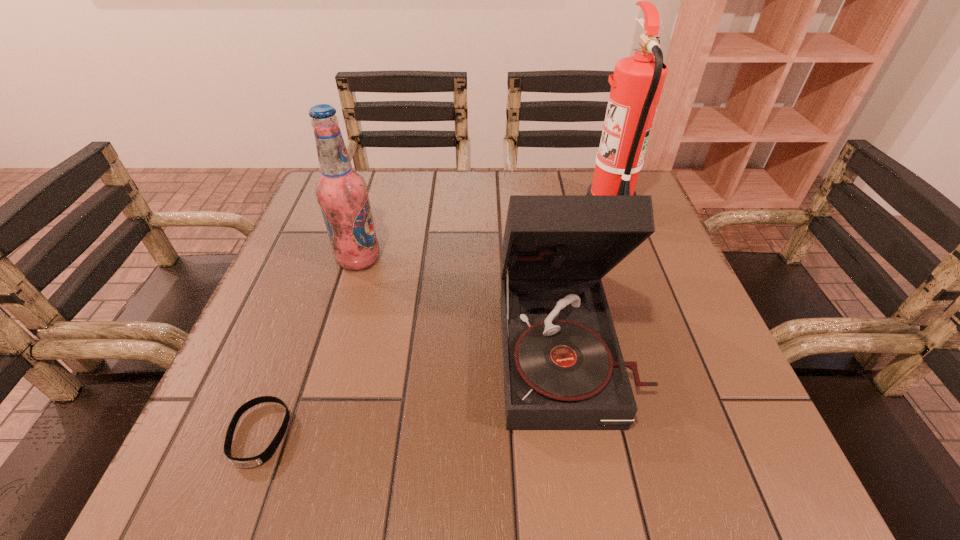
I want to click on the farthest object, so click(x=636, y=86).

The height and width of the screenshot is (540, 960). Find the location of `fire extinguisher`. fire extinguisher is located at coordinates (636, 86).

This screenshot has height=540, width=960. I want to click on alcohol, so click(x=342, y=193).

Find the location of `phonograph_record`. phonograph_record is located at coordinates (563, 367).

Locate an element on the screen. This screenshot has width=960, height=540. wristband is located at coordinates (260, 459).

In order to click on free space located at the nozzle of the farthest object in this screenshot , I will do `click(487, 208)`.

Locate an element on the screen. vacant space situated 0.220m at the nozzle of the farthest object is located at coordinates (498, 208).

Locate an element on the screen. The width and height of the screenshot is (960, 540). vacant area situated 0.150m at the nozzle of the farthest object is located at coordinates (526, 208).

Find the location of a particular element. The height and width of the screenshot is (540, 960). vacant region located on the right of the alcohol is located at coordinates (531, 259).

This screenshot has height=540, width=960. I want to click on object present at the far edge, so click(x=636, y=86).